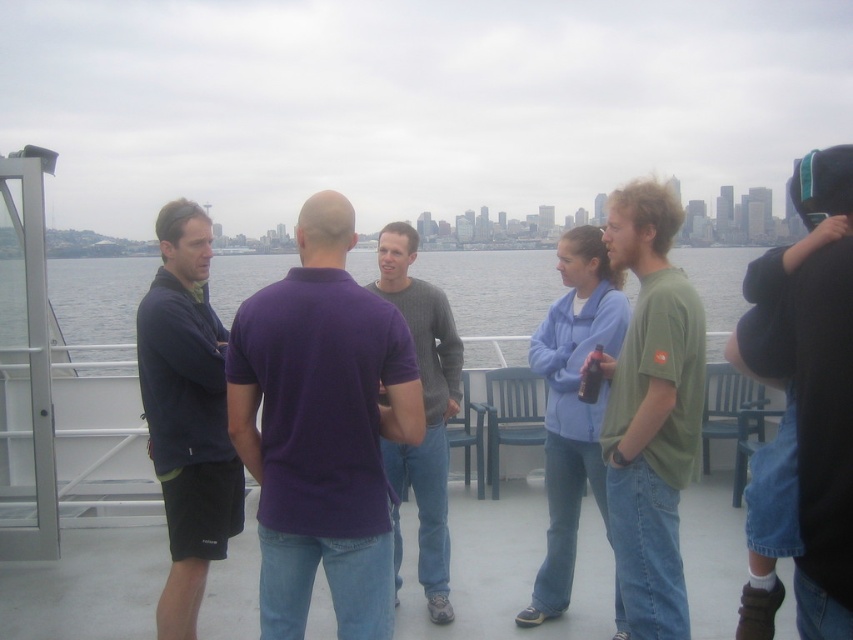
You are standing on the deck overlooking the harbor and notice two objects in the scene. One is the dark blue short sleeve shirt at left and the other is the clear water at center. Which object is closer to the front of the deck?

The dark blue short sleeve shirt at left is positioned under the clear water at center, so the clear water at center is closer to the front of the deck.

You are a photographer trying to capture the group of people on the deck. You notice the dark blue short sleeve shirt at left and the clear water at center. Which object should you focus on first if you want to ensure both are in the frame without moving the camera? Explain your reasoning based on their sizes.

The dark blue short sleeve shirt at left has a lesser width compared to the clear water at center. Since the clear water at center is wider, focusing on it first would help ensure both objects fit within the camera frame as the narrower dark blue shirt would occupy less space relative to the wider water area.

You are a photographer trying to capture a photo of the group on the deck. You notice the green matte shirt at center and the clear water at center in your viewfinder. Which object should you focus on first if you want to ensure both are in focus, given their relative heights?

The green matte shirt at center is not as tall as clear water at center, so you should focus on the clear water at center first to ensure both are in focus.